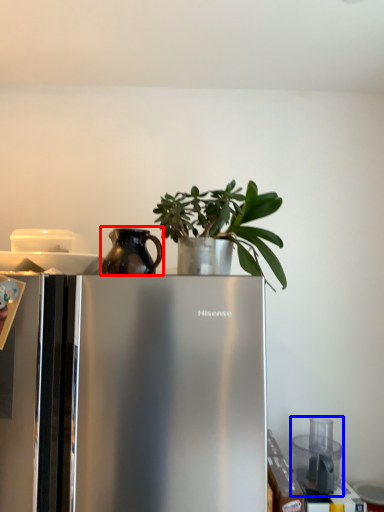
Question: Which point is closer to the camera, jug (highlighted by a red box) or appliance (highlighted by a blue box)?

Choices:
 (A) jug
 (B) appliance

Answer: (A)